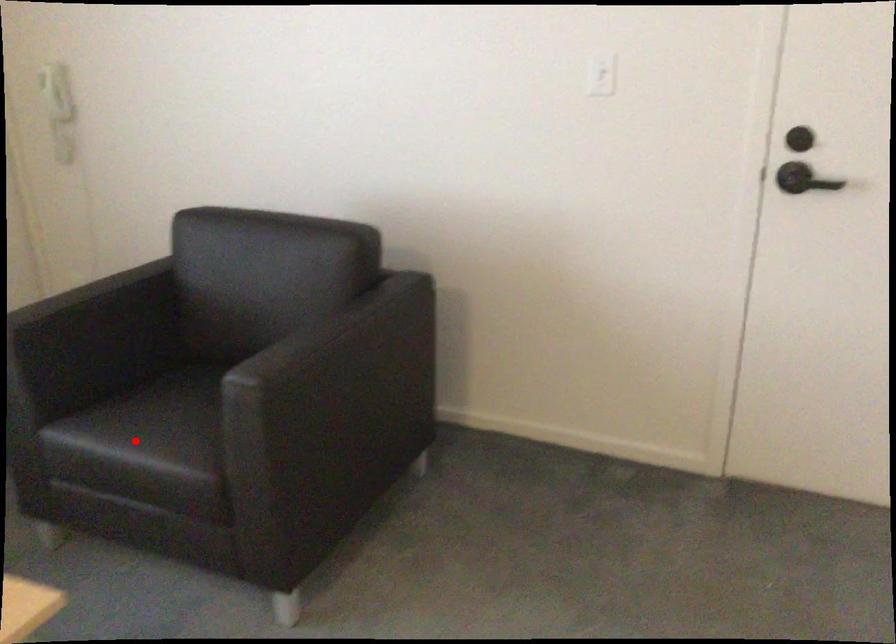
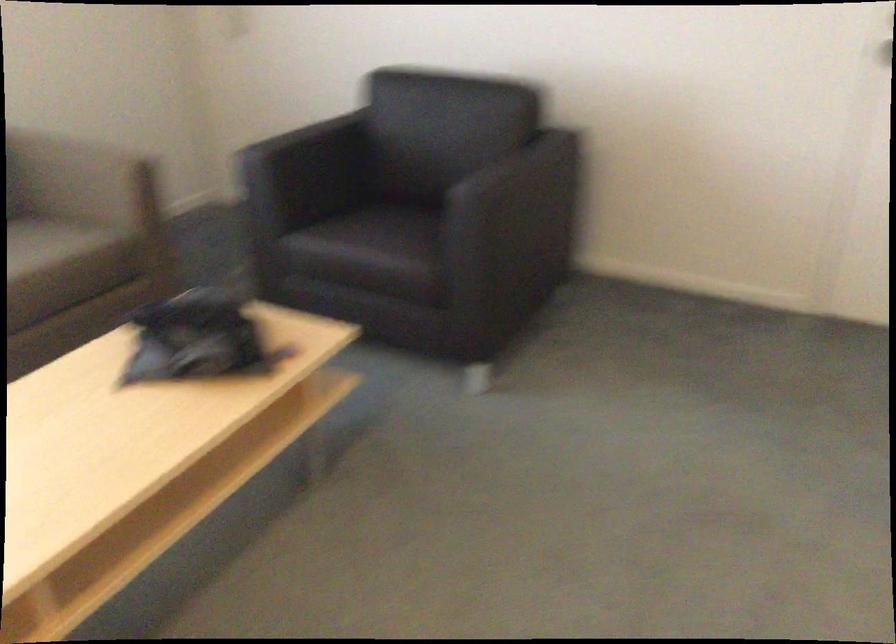
Question: I am providing you with two images of the same scene from different viewpoints. A red point is shown in image1. For the corresponding object point in image2, is it positioned nearer or farther from the camera?

Choices:
 (A) Nearer
 (B) Farther

Answer: (B)